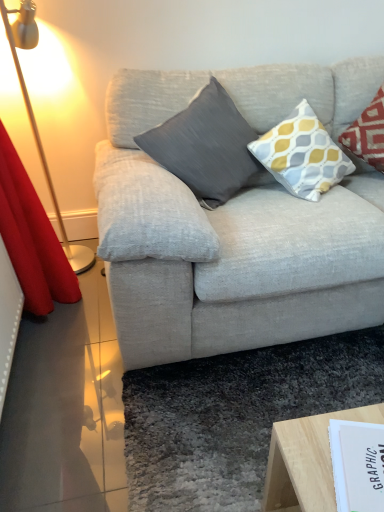
Question: From the image's perspective, is white paper at lower right below metallic gold floor lamp at left?

Choices:
 (A) yes
 (B) no

Answer: (A)

Question: Is white paper at lower right to the left of metallic gold floor lamp at left from the viewer's perspective?

Choices:
 (A) no
 (B) yes

Answer: (A)

Question: Is white paper at lower right far from metallic gold floor lamp at left?

Choices:
 (A) no
 (B) yes

Answer: (B)

Question: Is white paper at lower right turned away from metallic gold floor lamp at left?

Choices:
 (A) yes
 (B) no

Answer: (B)

Question: From the image's perspective, is white paper at lower right located above metallic gold floor lamp at left?

Choices:
 (A) no
 (B) yes

Answer: (A)

Question: From a real-world perspective, is white paper at lower right above or below metallic gold floor lamp at left?

Choices:
 (A) above
 (B) below

Answer: (B)

Question: From the image's perspective, is white paper at lower right positioned above or below metallic gold floor lamp at left?

Choices:
 (A) above
 (B) below

Answer: (B)

Question: From their relative heights in the image, would you say white paper at lower right is taller or shorter than metallic gold floor lamp at left?

Choices:
 (A) short
 (B) tall

Answer: (A)

Question: Considering the positions of white paper at lower right and metallic gold floor lamp at left in the image, is white paper at lower right wider or thinner than metallic gold floor lamp at left?

Choices:
 (A) wide
 (B) thin

Answer: (B)

Question: In the image, is metallic gold floor lamp at left positioned in front of or behind yellow and gray patterned pillow at upper right, marked as the first pillow in a right-to-left arrangement?

Choices:
 (A) behind
 (B) front

Answer: (B)

Question: In terms of height, does metallic gold floor lamp at left look taller or shorter compared to yellow and gray patterned pillow at upper right, marked as the first pillow in a right-to-left arrangement?

Choices:
 (A) tall
 (B) short

Answer: (A)

Question: From a real-world perspective, relative to yellow and gray patterned pillow at upper right, marked as the first pillow in a right-to-left arrangement, is metallic gold floor lamp at left vertically above or below?

Choices:
 (A) below
 (B) above

Answer: (A)

Question: Considering the positions of metallic gold floor lamp at left and yellow and gray patterned pillow at upper right, marked as the first pillow in a right-to-left arrangement, in the image, is metallic gold floor lamp at left wider or thinner than yellow and gray patterned pillow at upper right, marked as the first pillow in a right-to-left arrangement,?

Choices:
 (A) wide
 (B) thin

Answer: (B)

Question: Is point (201, 180) positioned closer to the camera than point (304, 150)?

Choices:
 (A) closer
 (B) farther

Answer: (A)

Question: Is matte gray pillow at center, placed as the 1th pillow when sorted from left to right, to the left or to the right of yellow and gray patterned pillow at upper right, marked as the first pillow in a right-to-left arrangement, in the image?

Choices:
 (A) right
 (B) left

Answer: (B)